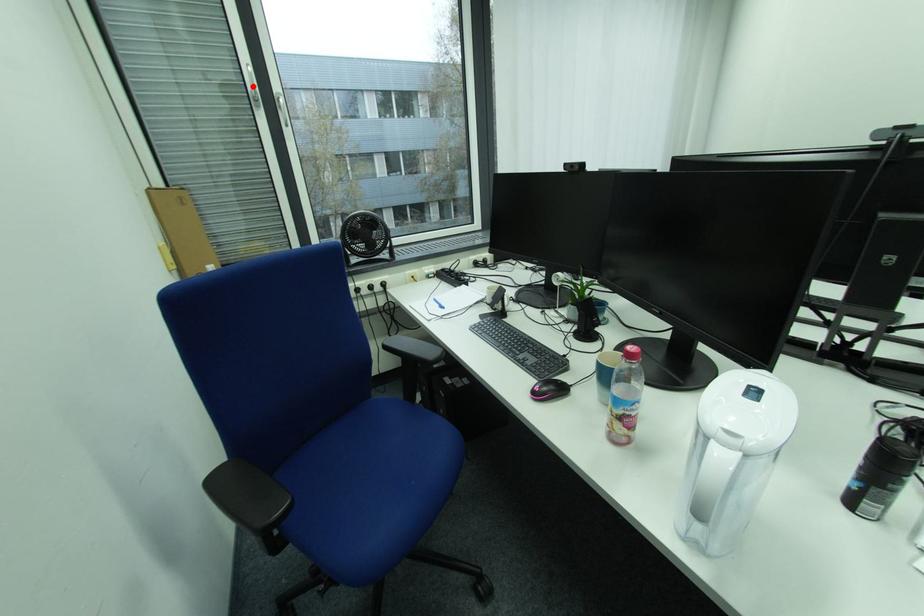
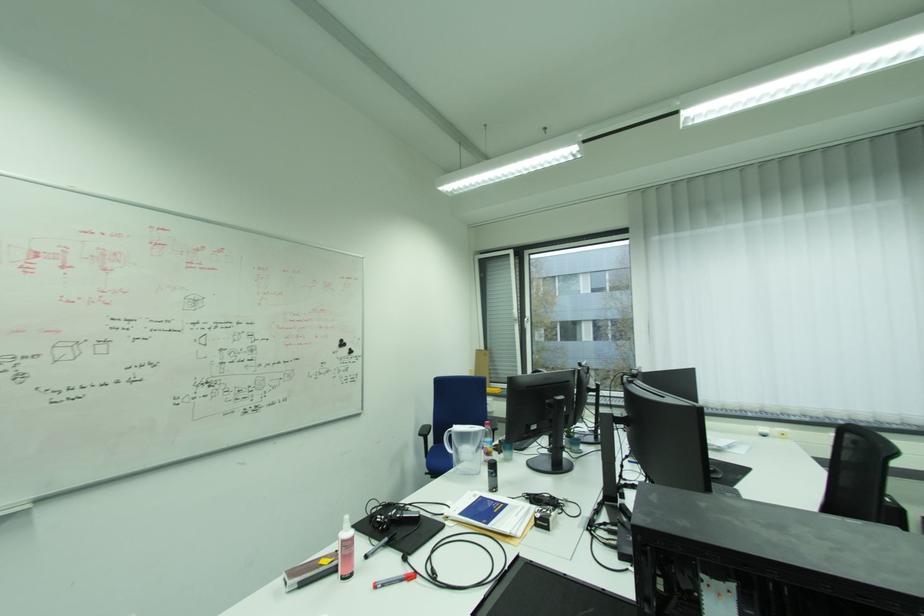
Question: I am providing you with two images of the same scene from different viewpoints. A red point is marked on the first image. At the location where the point appears in image 1, is it still visible in image 2?

Choices:
 (A) Yes
 (B) No

Answer: (B)